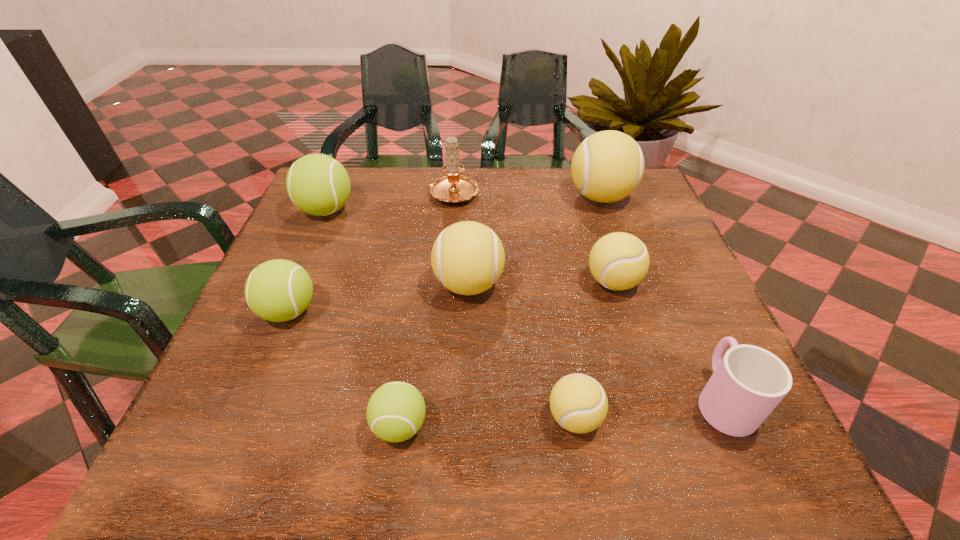
What are the coordinates of `the rightmost green tennis ball` in the screenshot? It's located at click(x=395, y=412).

Find the location of `the smallest green tennis ball`. the smallest green tennis ball is located at coordinates (395, 412).

This screenshot has width=960, height=540. What are the coordinates of `vacant space located 0.380m on the front of the farthest yellow tennis ball` in the screenshot? It's located at (648, 335).

Locate an element on the screen. This screenshot has width=960, height=540. free point located 0.200m on the left of the candle is located at coordinates (357, 192).

Where is `vacant region located on the right of the biggest green tennis ball`? The image size is (960, 540). vacant region located on the right of the biggest green tennis ball is located at coordinates (394, 210).

This screenshot has height=540, width=960. Find the location of `free space located on the back of the leftmost yellow tennis ball`. free space located on the back of the leftmost yellow tennis ball is located at coordinates (471, 188).

Image resolution: width=960 pixels, height=540 pixels. What are the coordinates of `free space located 0.370m on the right of the second smallest green tennis ball` in the screenshot? It's located at (502, 311).

Image resolution: width=960 pixels, height=540 pixels. What are the coordinates of `free spot located on the front of the second smallest yellow tennis ball` in the screenshot? It's located at (648, 398).

This screenshot has width=960, height=540. I want to click on free space located 0.260m with the handle on the side of the cup, so click(664, 268).

At what (x,y) coordinates should I click in order to perform the action: click on free point located with the handle on the side of the cup. Please return your answer as a coordinate pair (x, y). Looking at the image, I should click on (696, 339).